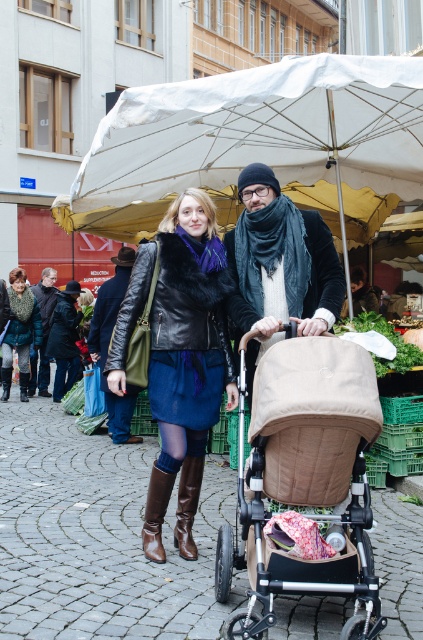
Between beige fabric stroller at center and leather boots at lower center, which one appears on the right side from the viewer's perspective?

beige fabric stroller at center

Locate an element on the screen. beige fabric stroller at center is located at coordinates (304, 480).

The width and height of the screenshot is (423, 640). In order to click on beige fabric stroller at center in this screenshot , I will do `click(304, 480)`.

Does beige fabric stroller at center appear under knitted wool sweater at lower left?

Correct, beige fabric stroller at center is located below knitted wool sweater at lower left.

Is beige fabric stroller at center thinner than knitted wool sweater at lower left?

In fact, beige fabric stroller at center might be wider than knitted wool sweater at lower left.

What do you see at coordinates (304, 480) in the screenshot? I see `beige fabric stroller at center` at bounding box center [304, 480].

Identify the location of beige fabric stroller at center. click(x=304, y=480).

Which is above, brown leather boot at lower center or leather boots at lower center?

leather boots at lower center

Which is more to the right, brown leather boot at lower center or leather boots at lower center?

Positioned to the right is brown leather boot at lower center.

You are a GUI agent. You are given a task and a screenshot of the screen. Output one action in this format:
    pyautogui.click(x=<x>, y=<y>)
    Task: Click on the brown leather boot at lower center
    This screenshot has width=423, height=640.
    Given the screenshot: What is the action you would take?
    tap(187, 506)